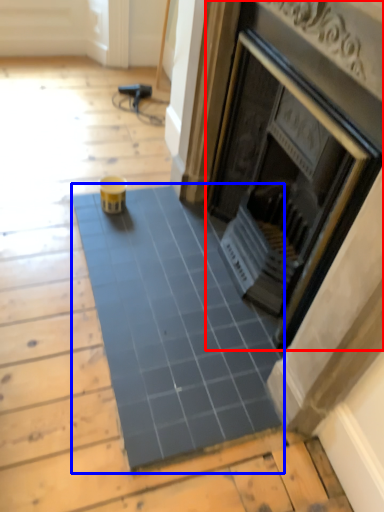
Question: Which point is further to the camera, fireplace (highlighted by a red box) or ceramic tile (highlighted by a blue box)?

Choices:
 (A) fireplace
 (B) ceramic tile

Answer: (B)